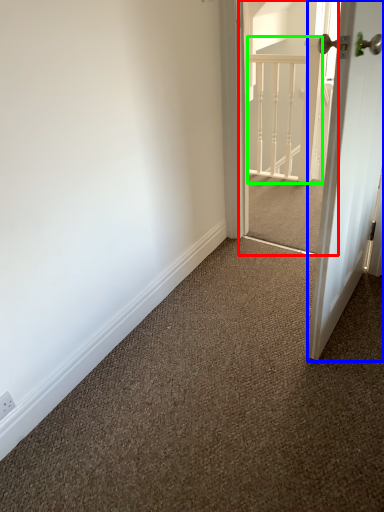
Question: Which object is the closest to the screen door (highlighted by a red box)? Choose among these: door (highlighted by a blue box) or rail (highlighted by a green box).

Choices:
 (A) door
 (B) rail

Answer: (B)